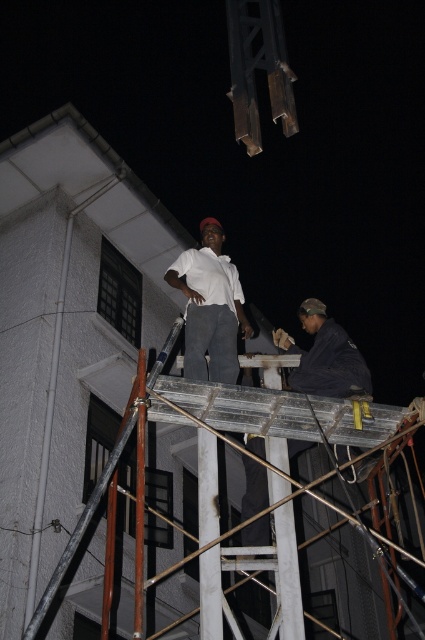
Between rusty metal ladder at upper center and white matte shirt at center, which one is positioned higher?

white matte shirt at center is above.

Is rusty metal ladder at upper center below white matte shirt at center?

Correct, rusty metal ladder at upper center is located below white matte shirt at center.

Between point (195, 419) and point (197, 320), which one is positioned behind?

The point (197, 320) is more distant.

Identify the location of rusty metal ladder at upper center. The height and width of the screenshot is (640, 425). (265, 410).

Which is more to the right, white matte shirt at center or dark gray fabric at center?

dark gray fabric at center is more to the right.

Is point (207, 368) farther from camera compared to point (255, 438)?

Yes, point (207, 368) is behind point (255, 438).

Is point (195, 342) positioned before point (319, 307)?

Yes, point (195, 342) is in front of point (319, 307).

At what (x,y) coordinates should I click in order to perform the action: click on white matte shirt at center. Please return your answer as a coordinate pair (x, y). The height and width of the screenshot is (640, 425). Looking at the image, I should click on [209, 307].

Does rusty metal ladder at upper center appear on the left side of dark gray fabric at center?

Yes, rusty metal ladder at upper center is to the left of dark gray fabric at center.

Is rusty metal ladder at upper center to the right of dark gray fabric at center from the viewer's perspective?

In fact, rusty metal ladder at upper center is to the left of dark gray fabric at center.

Does point (220, 429) come in front of point (305, 365)?

Yes, point (220, 429) is in front of point (305, 365).

The image size is (425, 640). In order to click on rusty metal ladder at upper center in this screenshot , I will do `click(265, 410)`.